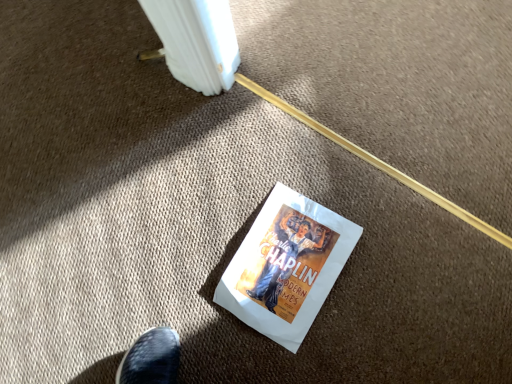
Find the location of a particular element. vacant space behind white paper at center is located at coordinates (243, 169).